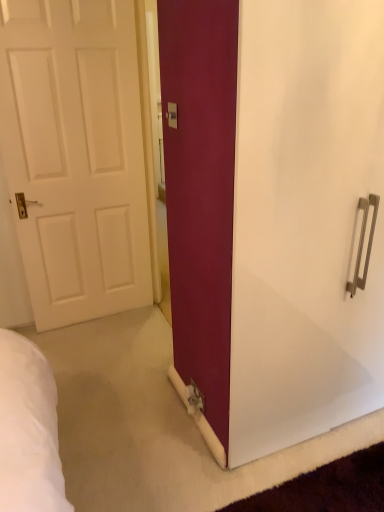
Question: From a real-world perspective, is matte white screen door at center on top of matte white electric outlet at center?

Choices:
 (A) yes
 (B) no

Answer: (B)

Question: Can you confirm if matte white screen door at center is bigger than matte white electric outlet at center?

Choices:
 (A) yes
 (B) no

Answer: (A)

Question: Does matte white screen door at center appear on the right side of matte white electric outlet at center?

Choices:
 (A) no
 (B) yes

Answer: (B)

Question: Can you confirm if matte white screen door at center is positioned to the left of matte white electric outlet at center?

Choices:
 (A) yes
 (B) no

Answer: (B)

Question: Does matte white screen door at center have a greater width compared to matte white electric outlet at center?

Choices:
 (A) no
 (B) yes

Answer: (B)

Question: Can you see matte white screen door at center touching matte white electric outlet at center?

Choices:
 (A) yes
 (B) no

Answer: (B)

Question: From a real-world perspective, is matte white electric outlet at center positioned over matte white screen door at center based on gravity?

Choices:
 (A) no
 (B) yes

Answer: (B)

Question: Is matte white electric outlet at center facing towards matte white screen door at center?

Choices:
 (A) yes
 (B) no

Answer: (B)

Question: Is matte white electric outlet at center not close to matte white screen door at center?

Choices:
 (A) no
 (B) yes

Answer: (A)

Question: Can we say matte white electric outlet at center lies outside matte white screen door at center?

Choices:
 (A) no
 (B) yes

Answer: (B)

Question: Does matte white electric outlet at center have a greater width compared to matte white screen door at center?

Choices:
 (A) yes
 (B) no

Answer: (B)

Question: Can you confirm if matte white electric outlet at center is thinner than matte white screen door at center?

Choices:
 (A) no
 (B) yes

Answer: (B)

Question: Does white matte door at left come behind matte white screen door at center?

Choices:
 (A) no
 (B) yes

Answer: (B)